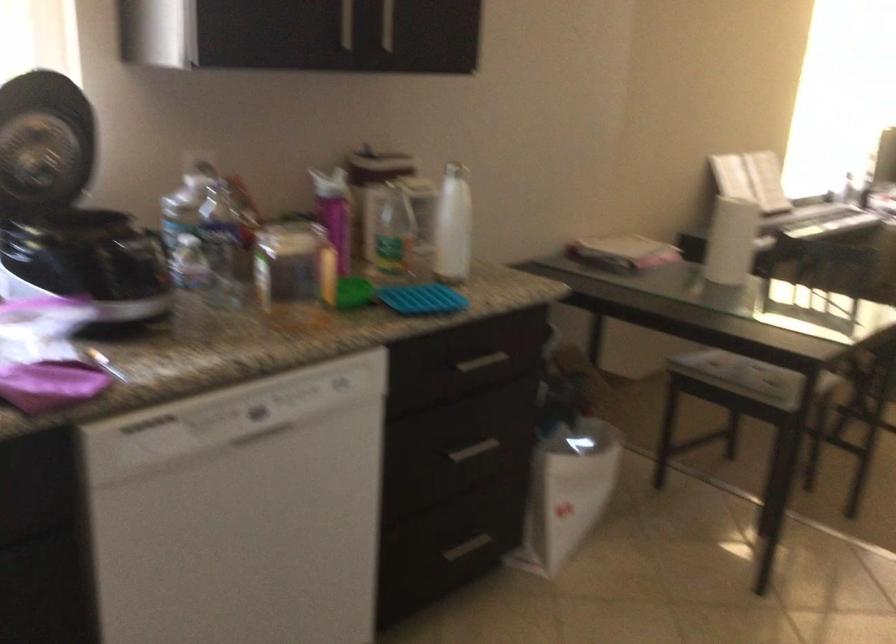
First-person continuous shooting, in which direction is the camera rotating?

The camera's rotation is toward left-down.